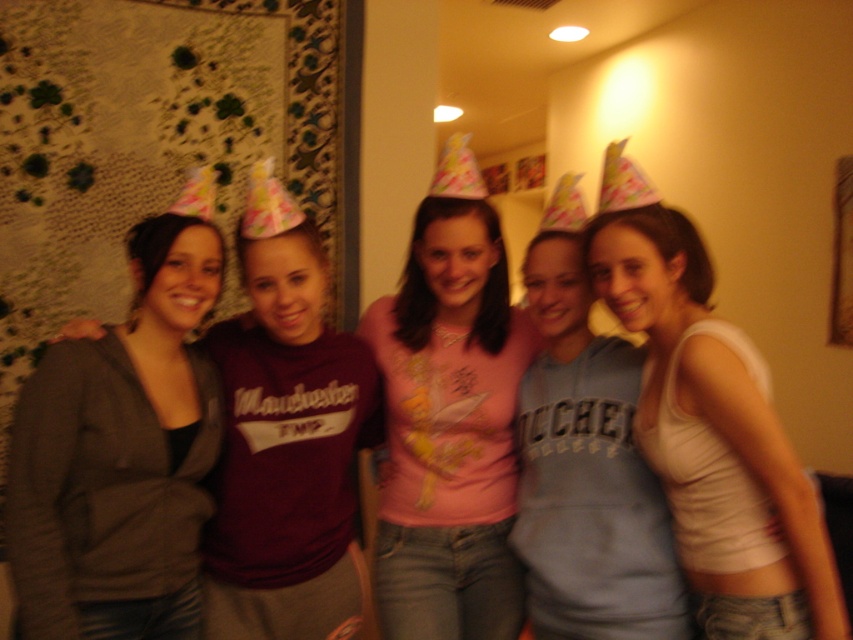
Does matte gray hoodie at center come in front of white tank top at center?

No, matte gray hoodie at center is further to the viewer.

From the picture: Between matte gray hoodie at center and white tank top at center, which one appears on the left side from the viewer's perspective?

Positioned to the left is matte gray hoodie at center.

The image size is (853, 640). I want to click on matte gray hoodie at center, so click(119, 456).

Identify the location of matte gray hoodie at center. Image resolution: width=853 pixels, height=640 pixels. (119, 456).

Is matte gray hoodie at center bigger than pink fabric shirt at center?

No, matte gray hoodie at center is not bigger than pink fabric shirt at center.

Between point (144, 500) and point (503, 374), which one is positioned behind?

Point (503, 374)

Where is `matte gray hoodie at center`? This screenshot has height=640, width=853. matte gray hoodie at center is located at coordinates (119, 456).

Can you confirm if pink fabric shirt at center is positioned to the right of white tank top at center?

Incorrect, pink fabric shirt at center is not on the right side of white tank top at center.

I want to click on pink fabric shirt at center, so click(x=450, y=429).

This screenshot has height=640, width=853. What do you see at coordinates (450, 429) in the screenshot? I see `pink fabric shirt at center` at bounding box center [450, 429].

Where is `pink fabric shirt at center`? This screenshot has height=640, width=853. pink fabric shirt at center is located at coordinates (450, 429).